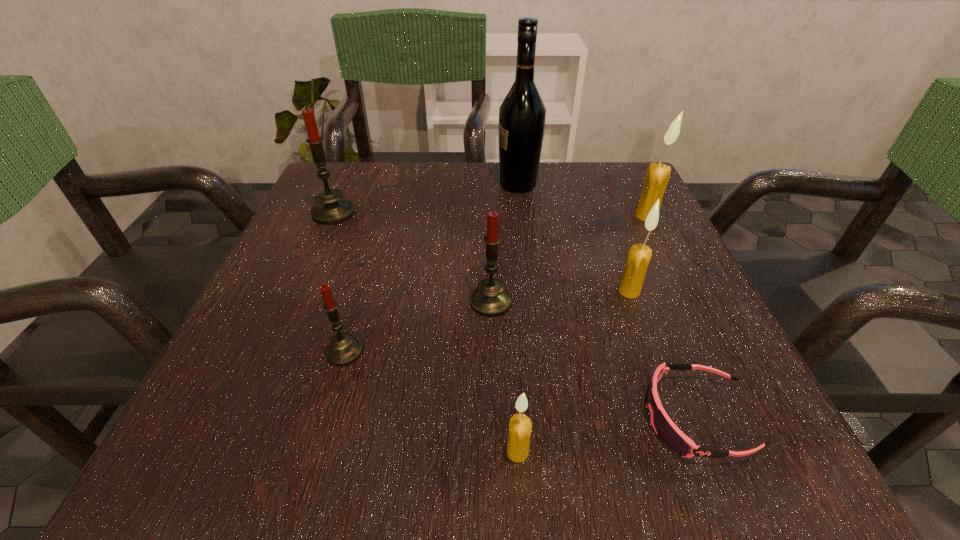
Where is `the nearest red candle`? This screenshot has height=540, width=960. the nearest red candle is located at coordinates (344, 349).

Identify the location of the smallest red candle. (344, 349).

What are the coordinates of `the smallest cream candle` in the screenshot? It's located at (520, 427).

You are a GUI agent. You are given a task and a screenshot of the screen. Output one action in this format:
    pyautogui.click(x=<x>, y=<y>)
    Task: Click on the nearest cream candle
    The image size is (960, 540).
    Given the screenshot: What is the action you would take?
    pyautogui.click(x=520, y=427)

At what (x,y) coordinates should I click in order to perform the action: click on pink goggles. Please return your answer as a coordinate pair (x, y). This screenshot has height=540, width=960. Looking at the image, I should click on (669, 433).

What are the coordinates of `goggles` in the screenshot? It's located at (669, 433).

What are the coordinates of `vacant space located on the label of the black wine bottle` in the screenshot? It's located at (379, 184).

This screenshot has width=960, height=540. In order to click on free space located 0.350m on the label of the black wine bottle in this screenshot , I will do `click(345, 184)`.

At what (x,y) coordinates should I click in order to perform the action: click on vacant space located 0.150m on the label of the black wine bottle. Please return your answer as a coordinate pair (x, y). This screenshot has height=540, width=960. Looking at the image, I should click on (431, 184).

Identify the location of vacant space positioned on the right of the biggest red candle. (483, 213).